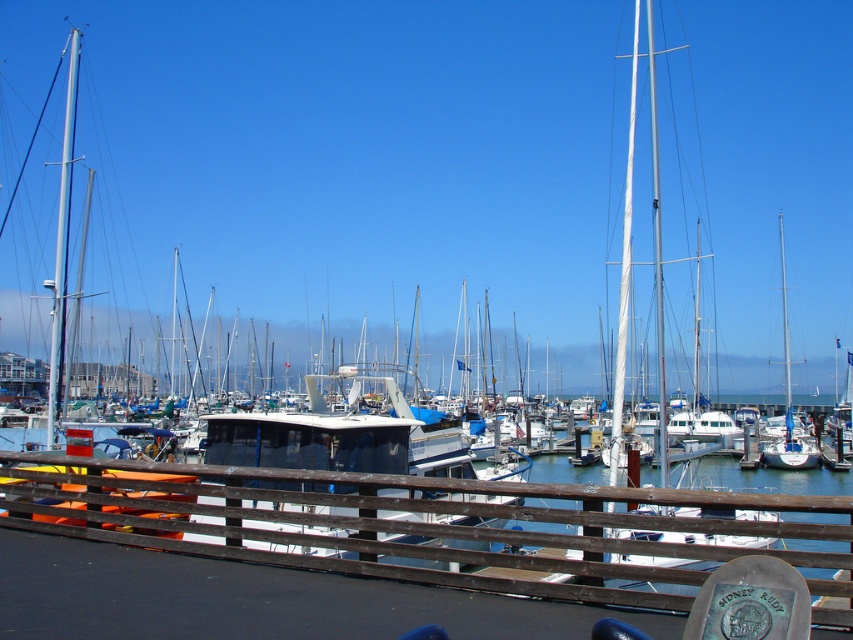
Is white matte sailboat at center above silver metallic mast at left?

Yes.

Is point (659, 388) behind point (49, 429)?

No.

Locate an element on the screen. This screenshot has width=853, height=640. white matte sailboat at center is located at coordinates (653, 237).